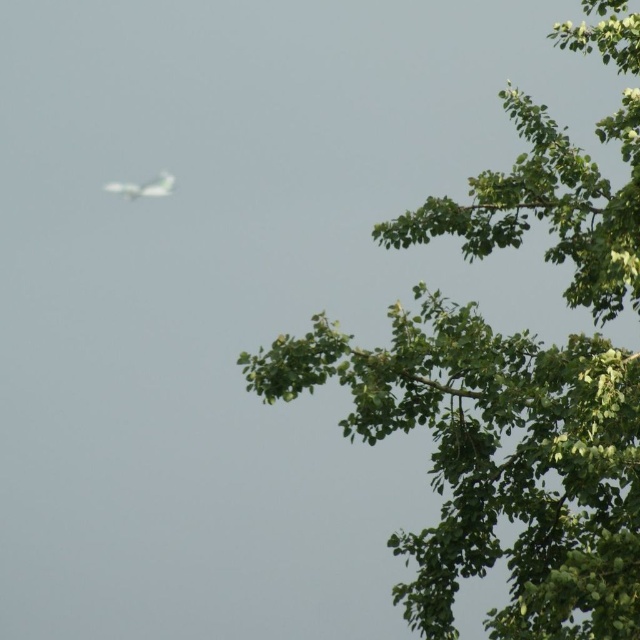
You are standing in a park and want to take a photo of the green leafy tree at upper right. If the recommended distance for a clear photo is at least 25 feet, should you move closer or farther away?

The green leafy tree at upper right is 24.09 feet from viewer. Since 24.09 feet is less than 25 feet, you should move slightly farther away to ensure the photo is clear.

You are standing in the middle of the scene and want to take a photo of the green leafy tree at upper right. Where should you point your camera? Is the point at coordinates (497, 461) the correct location to aim for?

Yes, the point at coordinates (497, 461) is the correct location to aim for because the green leafy tree at upper right is precisely located there according to the description.

You are an observer looking at the image. You notice the green leafy tree at upper right and the white matte airplane at upper left. Which object is closer to the top edge of the image?

The white matte airplane at upper left is closer to the top edge of the image because the green leafy tree at upper right is positioned under it.